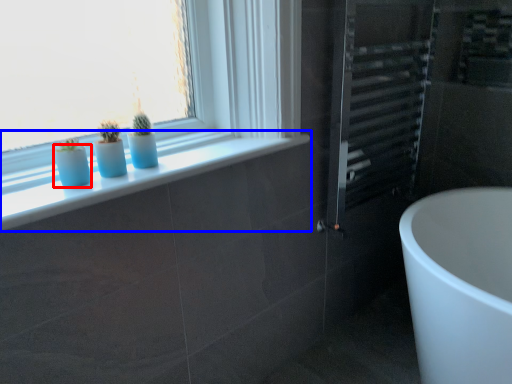
Question: Which object is further to the camera taking this photo, glass vase (highlighted by a red box) or window sill (highlighted by a blue box)?

Choices:
 (A) glass vase
 (B) window sill

Answer: (A)